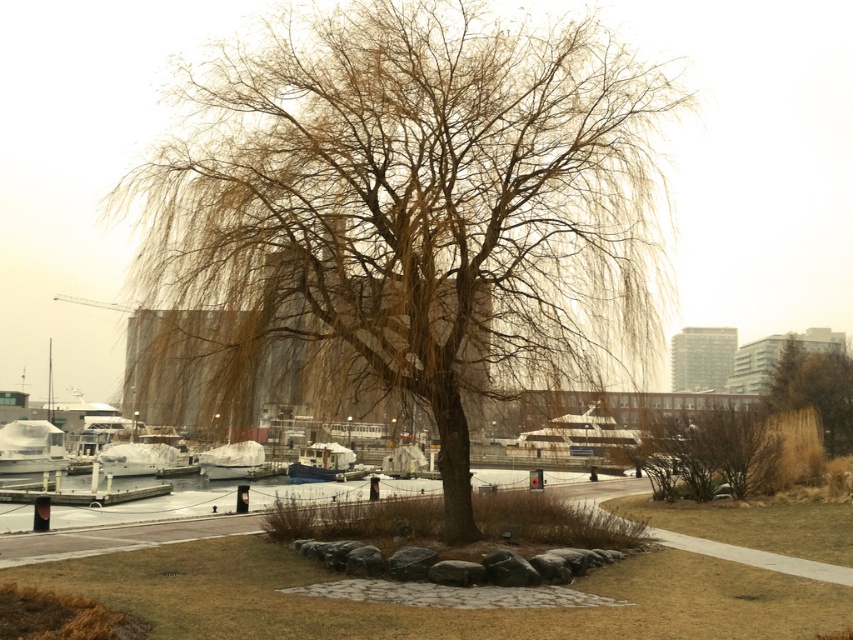
Question: Is white matte boat at lower left further to camera compared to white plastic boat at center?

Choices:
 (A) no
 (B) yes

Answer: (A)

Question: Estimate the real-world distances between objects in this image. Which object is farther from the brown/dry bush at lower right?

Choices:
 (A) white matte boat at lower left
 (B) brown textured tree at right
 (C) white matte boat at lower center
 (D) white plastic boat at center

Answer: (A)

Question: Which of the following is the farthest from the observer?

Choices:
 (A) (341, 474)
 (B) (172, 467)
 (C) (851, 440)

Answer: (B)

Question: Is brown textured tree at right above white plastic boat at center?

Choices:
 (A) no
 (B) yes

Answer: (B)

Question: Can you confirm if brown textured tree at right is positioned below white plastic boat at center?

Choices:
 (A) no
 (B) yes

Answer: (A)

Question: Which is nearer to the white plastic boat at center?

Choices:
 (A) white matte boat at lower left
 (B) brown textured tree at right

Answer: (A)